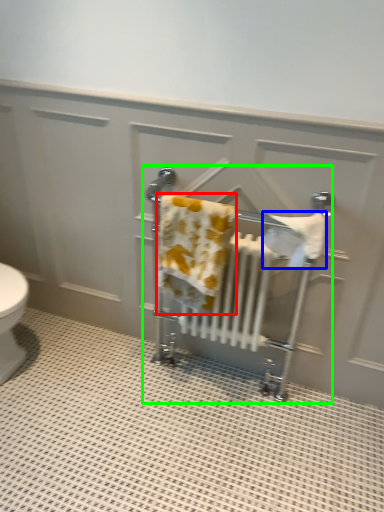
Question: Estimate the real-world distances between objects in this image. Which object is closer to bath towel (highlighted by a red box), bath towel (highlighted by a blue box) or baby carriage (highlighted by a green box)?

Choices:
 (A) bath towel
 (B) baby carriage

Answer: (B)